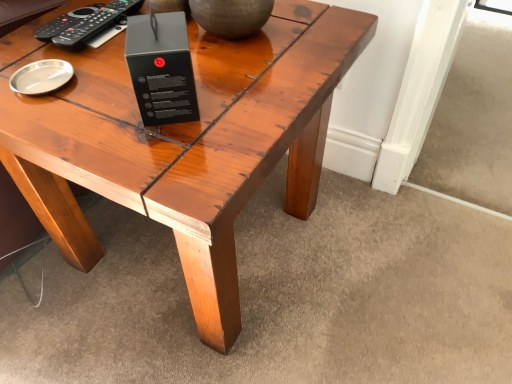
Identify the location of shiny wood table at center. (183, 143).

What do you see at coordinates (183, 143) in the screenshot? I see `shiny wood table at center` at bounding box center [183, 143].

Measure the distance between point [189,248] and camera.

Point [189,248] and camera are 24.57 inches apart from each other.

What is the approximate height of shiny wood table at center?

Answer: The height of shiny wood table at center is 21.86 inches.

Locate an element on the screen. shiny wood table at center is located at coordinates (183, 143).